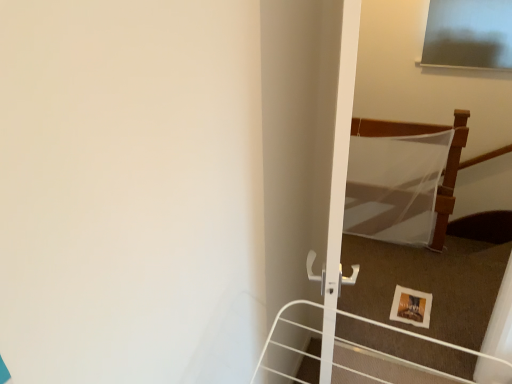
Question: Is point coord(465,130) positioned closer to the camera than point coord(421,322)?

Choices:
 (A) farther
 (B) closer

Answer: (A)

Question: Looking at their shapes, would you say white sheer fabric at upper right is wider or thinner than wooden picture frame at lower right?

Choices:
 (A) wide
 (B) thin

Answer: (B)

Question: In the image, is white sheer fabric at upper right positioned in front of or behind wooden picture frame at lower right?

Choices:
 (A) front
 (B) behind

Answer: (B)

Question: Considering the positions of wooden picture frame at lower right and white sheer fabric at upper right in the image, is wooden picture frame at lower right wider or thinner than white sheer fabric at upper right?

Choices:
 (A) thin
 (B) wide

Answer: (B)

Question: In the image, is wooden picture frame at lower right positioned in front of or behind white sheer fabric at upper right?

Choices:
 (A) behind
 (B) front

Answer: (B)

Question: Considering the positions of wooden picture frame at lower right and white sheer fabric at upper right in the image, is wooden picture frame at lower right bigger or smaller than white sheer fabric at upper right?

Choices:
 (A) big
 (B) small

Answer: (B)

Question: From a real-world perspective, is wooden picture frame at lower right above or below white sheer fabric at upper right?

Choices:
 (A) below
 (B) above

Answer: (A)